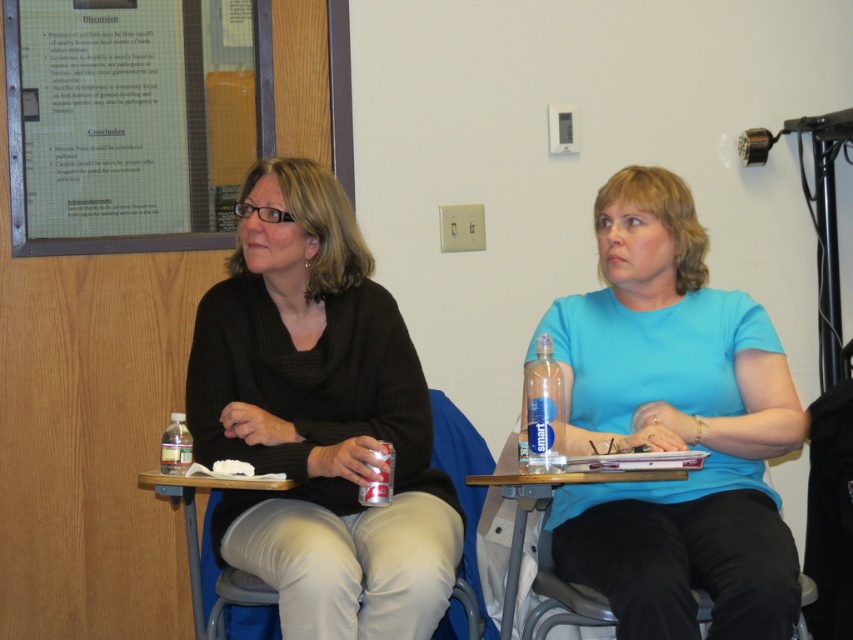
Does matte blue shirt at center appear under wooden table at lower center?

Actually, matte blue shirt at center is above wooden table at lower center.

Can you confirm if matte blue shirt at center is positioned to the right of wooden table at lower center?

Indeed, matte blue shirt at center is positioned on the right side of wooden table at lower center.

Between point (671, 273) and point (218, 484), which one is positioned behind?

The point (671, 273) is behind.

Find the location of `matte blue shirt at center`. matte blue shirt at center is located at coordinates (672, 428).

Does point (280, 563) lie in front of point (438, 460)?

Yes, it is in front of point (438, 460).

Image resolution: width=853 pixels, height=640 pixels. What do you see at coordinates (318, 419) in the screenshot?
I see `black sweater at left` at bounding box center [318, 419].

Find the location of a particular element. Image resolution: width=853 pixels, height=640 pixels. black sweater at left is located at coordinates (318, 419).

Does blue fabric chair at center appear on the left side of clear plastic water bottle at center?

Yes, blue fabric chair at center is to the left of clear plastic water bottle at center.

Is blue fabric chair at center positioned behind clear plastic water bottle at center?

Yes.

Who is more distant from viewer, (219, 566) or (549, 435)?

Positioned behind is point (219, 566).

Image resolution: width=853 pixels, height=640 pixels. What are the coordinates of `blue fabric chair at center` in the screenshot? It's located at (462, 483).